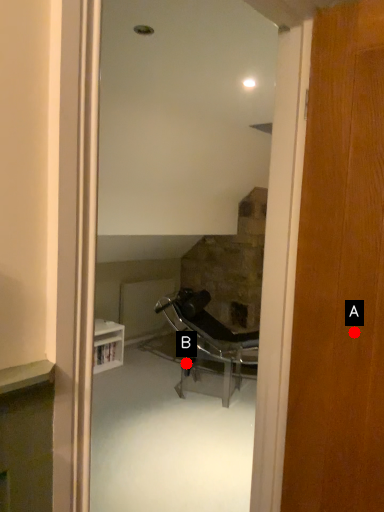
Question: Two points are circled on the image, labeled by A and B beside each circle. Which point appears closest to the camera in this image?

Choices:
 (A) A is closer
 (B) B is closer

Answer: (A)